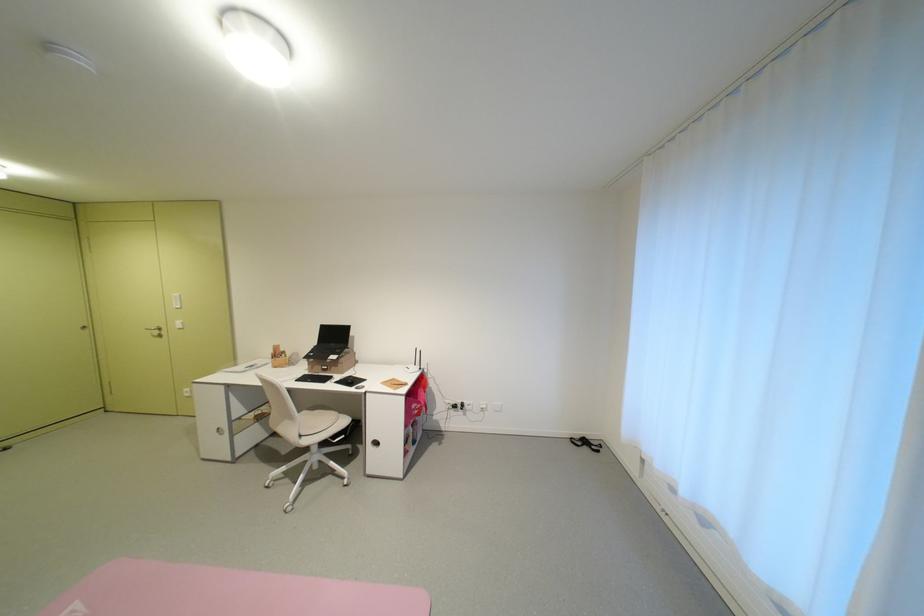
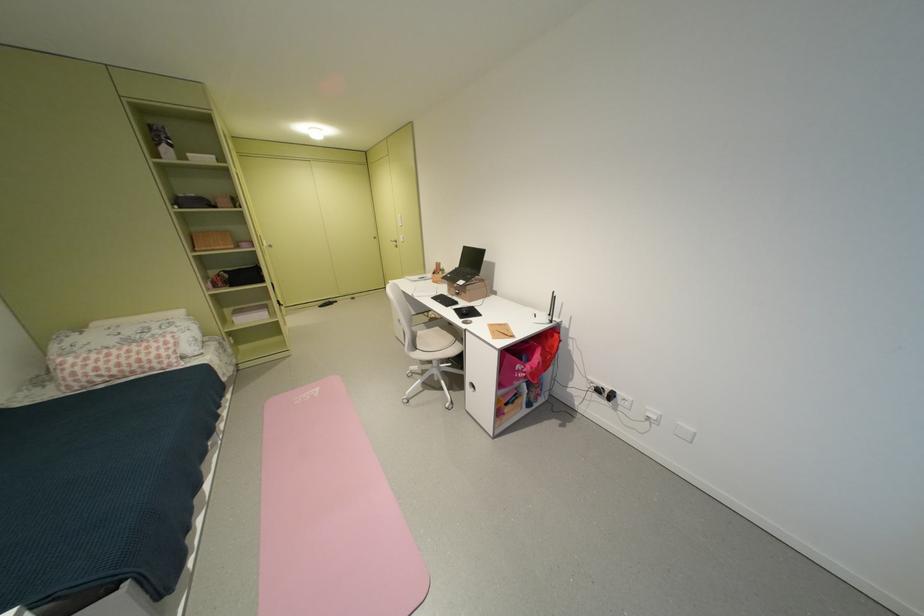
In the second image, find the point that corresponds to the point at 465,408 in the first image.

(609, 392)